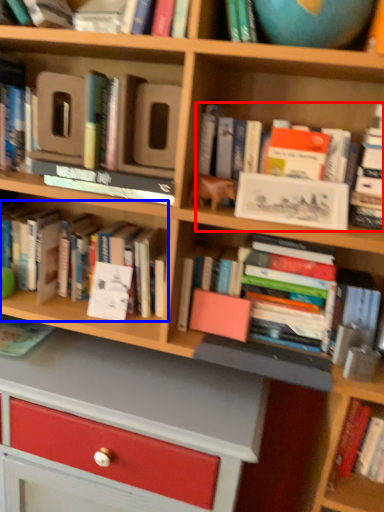
Question: Which object is closer to the camera taking this photo, book (highlighted by a red box) or book (highlighted by a blue box)?

Choices:
 (A) book
 (B) book

Answer: (A)